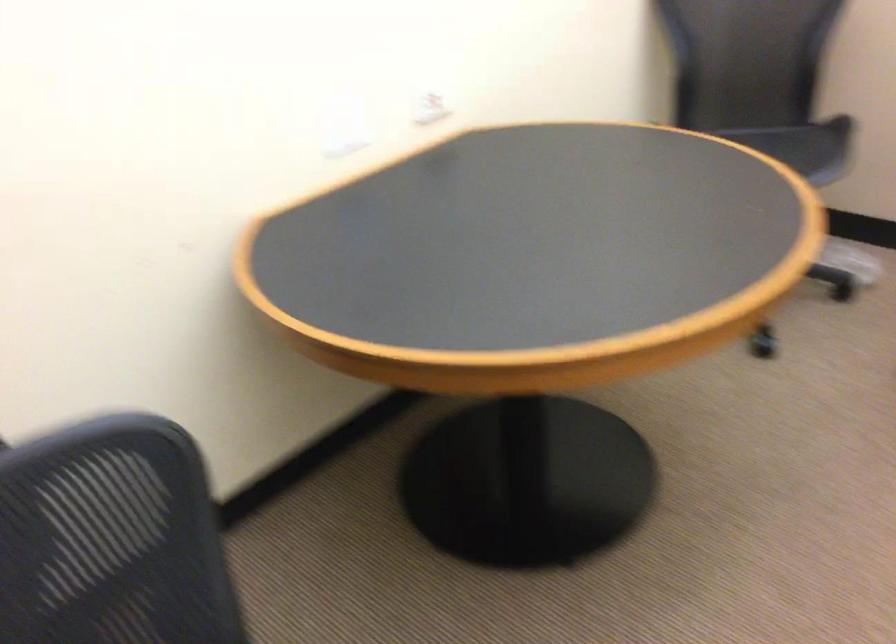
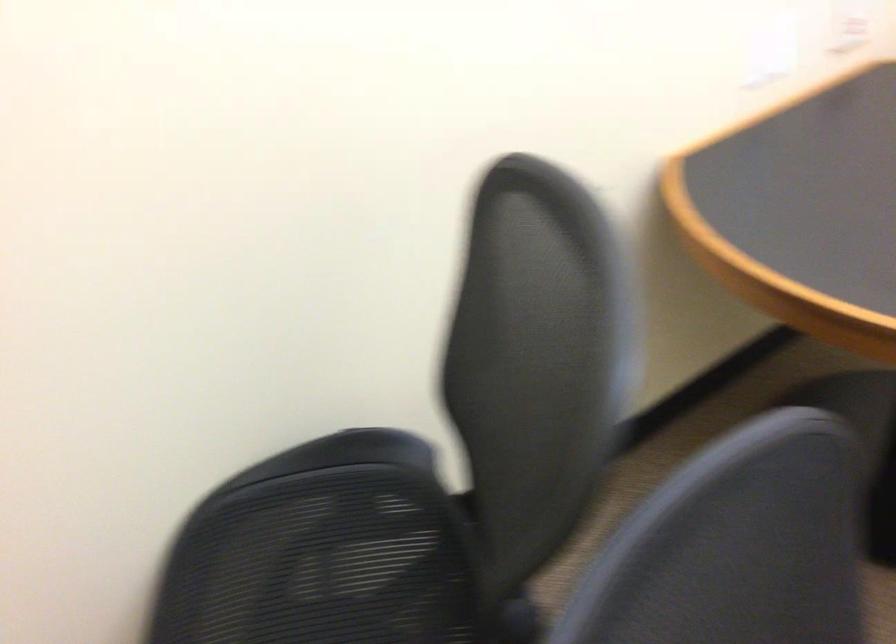
Question: The images are taken continuously from a first-person perspective. In which direction are you moving?

Choices:
 (A) Left
 (B) Right
 (C) Forward
 (D) Backward

Answer: (A)